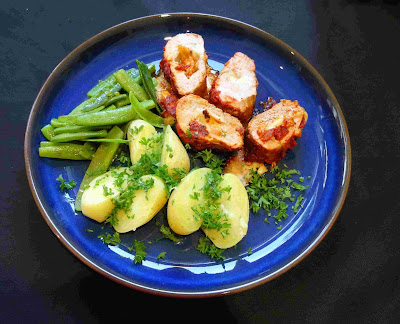
The image size is (400, 324). I want to click on black table, so click(x=389, y=260).